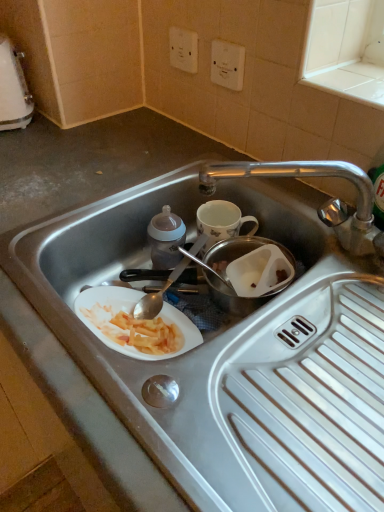
Question: Is white plastic kettle at upper left bigger or smaller than white plastic electric outlet at upper center, the 2th electric outlet in the left-to-right sequence?

Choices:
 (A) small
 (B) big

Answer: (B)

Question: Does point (9, 114) appear closer or farther from the camera than point (228, 64)?

Choices:
 (A) farther
 (B) closer

Answer: (A)

Question: Which object is the farthest from the white plastic kettle at upper left?

Choices:
 (A) white plastic electric outlet at upper center, the 2th electric outlet in the left-to-right sequence
 (B) white plastic electric outlet at upper center, arranged as the second electric outlet when viewed from the right
 (C) transparent plastic container at center
 (D) stainless steel sink at center

Answer: (D)

Question: Which object is positioned closest to the stainless steel sink at center?

Choices:
 (A) transparent plastic container at center
 (B) white plastic electric outlet at upper center, arranged as the second electric outlet when viewed from the right
 (C) white plastic electric outlet at upper center, positioned as the first electric outlet in right-to-left order
 (D) white plastic kettle at upper left

Answer: (A)